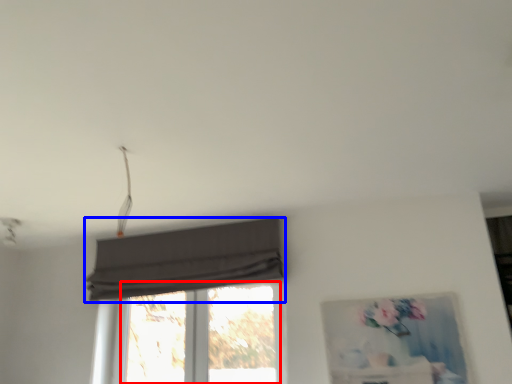
Question: Among these objects, which one is farthest to the camera, window (highlighted by a red box) or curtain (highlighted by a blue box)?

Choices:
 (A) window
 (B) curtain

Answer: (A)